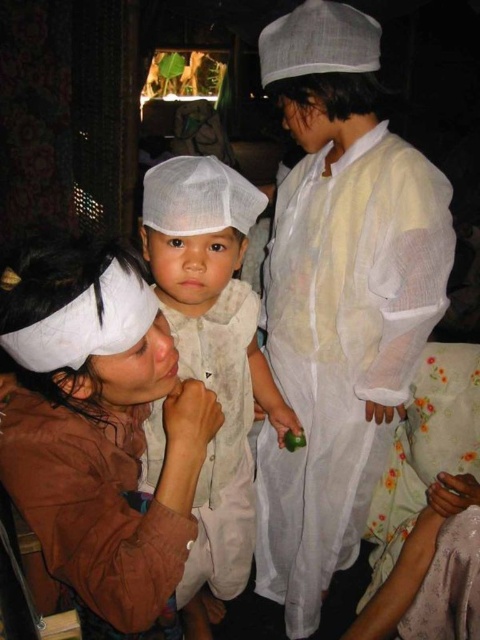
Can you confirm if brown suede jacket at lower left is bigger than white cotton hat at center?

No, brown suede jacket at lower left is not bigger than white cotton hat at center.

Between point (133, 573) and point (229, 529), which one is positioned in front?

Positioned in front is point (133, 573).

The width and height of the screenshot is (480, 640). I want to click on brown suede jacket at lower left, so click(x=99, y=428).

Is point (292, 554) positioned after point (107, 604)?

Yes, it is behind point (107, 604).

Which is more to the right, white sheer robe at center or brown suede jacket at lower left?

white sheer robe at center is more to the right.

Between point (322, 236) and point (84, 454), which one is positioned in front?

Positioned in front is point (84, 454).

This screenshot has width=480, height=640. Identify the location of white sheer robe at center. (343, 349).

Does point (267, 440) come farther from viewer compared to point (251, 376)?

Yes, it is behind point (251, 376).

Is white sheer robe at center taller than white cotton hat at center?

Yes.

Image resolution: width=480 pixels, height=640 pixels. I want to click on white sheer robe at center, so click(343, 349).

The width and height of the screenshot is (480, 640). Find the location of `white sheer robe at center`. white sheer robe at center is located at coordinates (343, 349).